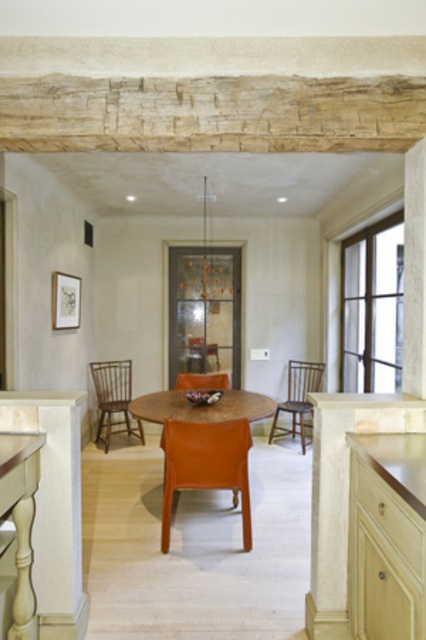
You are planning to place a rectangular cutting board on the wooden countertop at right. The cutting board is as wide as the wooden chair at center. Will it fit on the countertop?

The wooden countertop at right is narrower than the wooden chair at center, so the cutting board, being as wide as the chair, will not fit on the countertop.

You are sitting at the dining table and want to move to the other orange chair. Which direction should you move to reach the orange leather chair at center from the orange plastic chair at center?

The orange leather chair at center is positioned on the right side of the orange plastic chair at center, so you should move to the right to reach it.

You are standing in the dining area and need to place a small vase on the wooden countertop at right. Based on its coordinates, is the countertop located near the edge of the room or closer to the center?

The wooden countertop at right is located at coordinates point (386, 536), which places it near the edge of the room since the coordinates are closer to the maximum value on both axes.